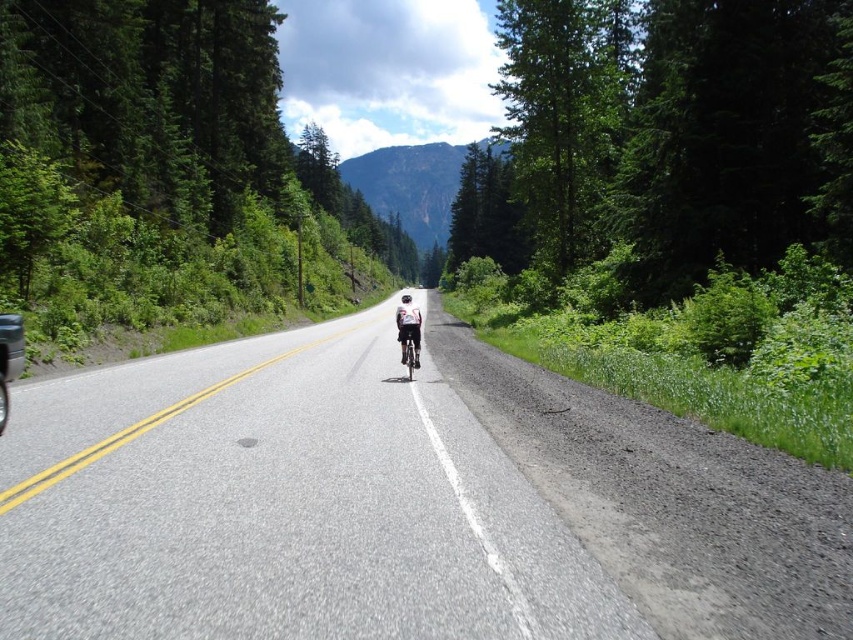
Question: Does gravelly dirt path at right appear under white matte bicycle helmet at center?

Choices:
 (A) yes
 (B) no

Answer: (A)

Question: Which of these objects is positioned farthest from the gravelly dirt path at right?

Choices:
 (A) gray asphalt road at center
 (B) shiny silver bicycle at center
 (C) white fabric cyclist at center
 (D) white matte bicycle helmet at center

Answer: (D)

Question: Is shiny silver bicycle at center positioned before white matte bicycle helmet at center?

Choices:
 (A) no
 (B) yes

Answer: (B)

Question: Among these points, which one is nearest to the camera?

Choices:
 (A) coord(407,336)
 (B) coord(405,301)
 (C) coord(308,596)
 (D) coord(488,380)

Answer: (C)

Question: Which object appears farthest from the camera in this image?

Choices:
 (A) gray asphalt road at center
 (B) white matte bicycle helmet at center
 (C) white fabric cyclist at center

Answer: (B)

Question: Does gray asphalt road at center appear under gravelly dirt path at right?

Choices:
 (A) yes
 (B) no

Answer: (B)